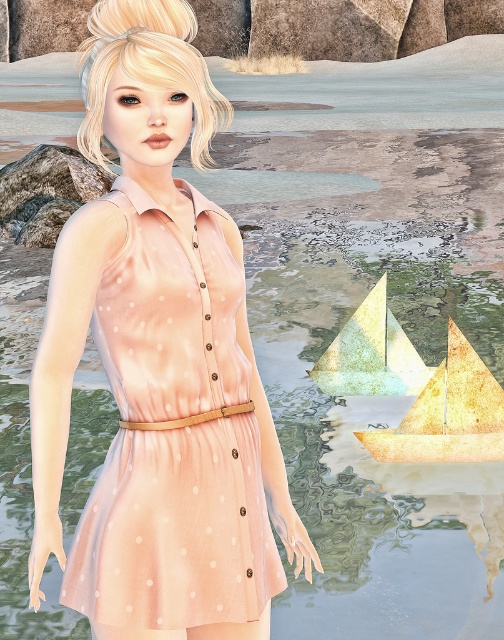
Is peach satin dress at center to the left of gold textured sailboat at lower right from the viewer's perspective?

Yes, peach satin dress at center is to the left of gold textured sailboat at lower right.

Does peach satin dress at center have a smaller size compared to gold textured sailboat at lower right?

Correct, peach satin dress at center occupies less space than gold textured sailboat at lower right.

Find the location of `peach satin dress at center`. peach satin dress at center is located at coordinates (175, 531).